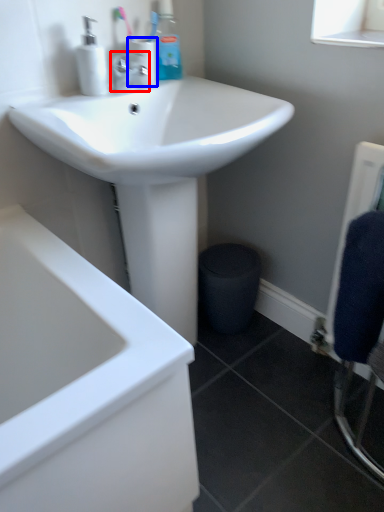
Question: Which of the following is the closest to the observer, tap (highlighted by a red box) or toiletry (highlighted by a blue box)?

Choices:
 (A) tap
 (B) toiletry

Answer: (A)